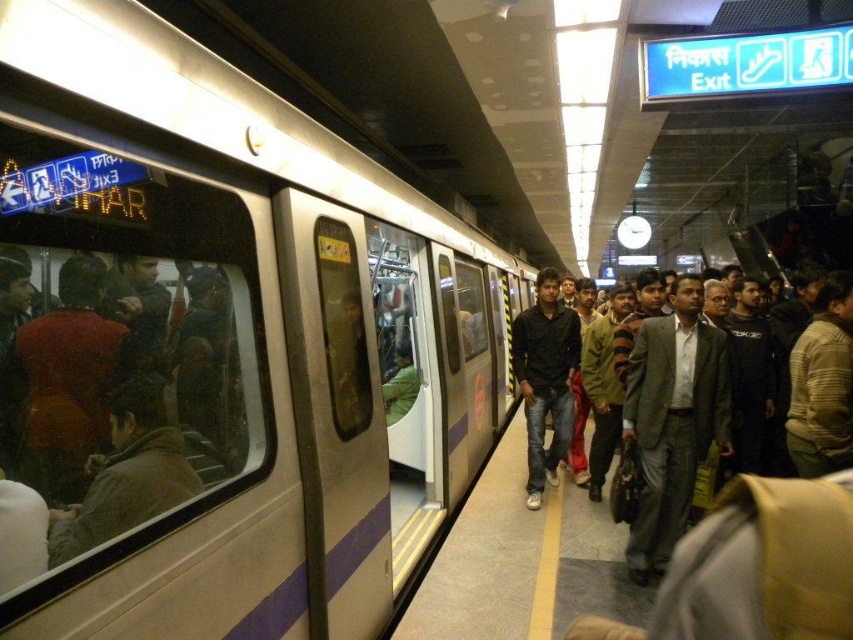
You are a photographer standing on the metro platform. You want to take a photo of the gray suit at center and the black matte shirt at center. Which one is closer to the camera?

The gray suit at center is in front of the black matte shirt at center, so the gray suit at center is closer to the camera.

You are a photographer standing on the platform of the Delhi Metro station. You want to take a photo of the dark gray suit at center and the brown leather jacket at left. Which of the two objects should you focus on first if you want to capture both in a single frame without moving the camera?

The dark gray suit at center is positioned under the brown leather jacket at left, so you should focus on the brown leather jacket at left first as it is closer to the camera. This will ensure that both subjects are in focus within the same frame.

You are standing on the metro platform and see the silver metallic train at center and the gray suit at center. Which object is closer to you?

The gray suit at center is closer to you because the silver metallic train at center is positioned over it, indicating the train is behind the suit.